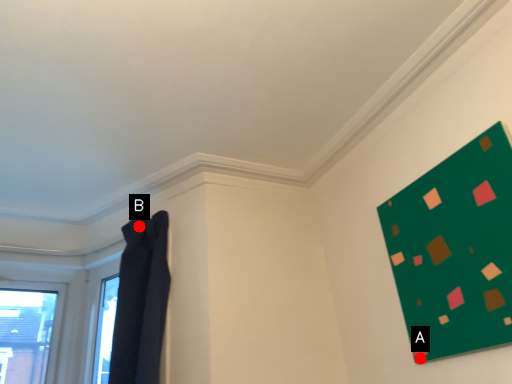
Question: Two points are circled on the image, labeled by A and B beside each circle. Among these points, which one is farthest from the camera?

Choices:
 (A) A is further
 (B) B is further

Answer: (B)